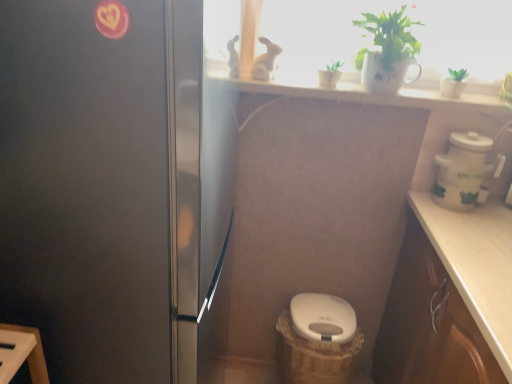
Question: Considering the relative sizes of white ceramic window sill at upper center and white ceramic pot at right in the image provided, is white ceramic window sill at upper center shorter than white ceramic pot at right?

Choices:
 (A) no
 (B) yes

Answer: (B)

Question: Does white ceramic window sill at upper center have a greater width compared to white ceramic pot at right?

Choices:
 (A) no
 (B) yes

Answer: (A)

Question: Is the surface of white ceramic window sill at upper center in direct contact with white ceramic pot at right?

Choices:
 (A) yes
 (B) no

Answer: (B)

Question: Does white ceramic window sill at upper center come in front of white ceramic pot at right?

Choices:
 (A) yes
 (B) no

Answer: (B)

Question: Does white ceramic window sill at upper center appear on the left side of white ceramic pot at right?

Choices:
 (A) yes
 (B) no

Answer: (A)

Question: Is white ceramic window sill at upper center looking in the opposite direction of white ceramic pot at right?

Choices:
 (A) no
 (B) yes

Answer: (A)

Question: Is satin black fridge at left far from white ceramic pot at right?

Choices:
 (A) yes
 (B) no

Answer: (B)

Question: Is satin black fridge at left positioned in front of white ceramic pot at right?

Choices:
 (A) no
 (B) yes

Answer: (B)

Question: Considering the relative sizes of satin black fridge at left and white ceramic pot at right in the image provided, is satin black fridge at left shorter than white ceramic pot at right?

Choices:
 (A) yes
 (B) no

Answer: (B)

Question: Can you confirm if satin black fridge at left is taller than white ceramic pot at right?

Choices:
 (A) yes
 (B) no

Answer: (A)

Question: Could you tell me if satin black fridge at left is turned towards white ceramic pot at right?

Choices:
 (A) no
 (B) yes

Answer: (B)

Question: Is satin black fridge at left at the right side of white ceramic pot at right?

Choices:
 (A) no
 (B) yes

Answer: (A)

Question: Is white glossy toilet bowl at center positioned in front of green matte plant at upper center, acting as the first houseplant starting from the left?

Choices:
 (A) yes
 (B) no

Answer: (B)